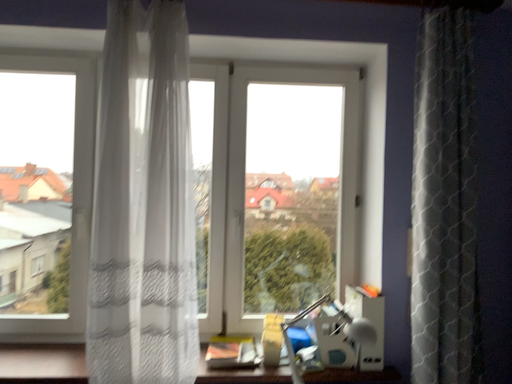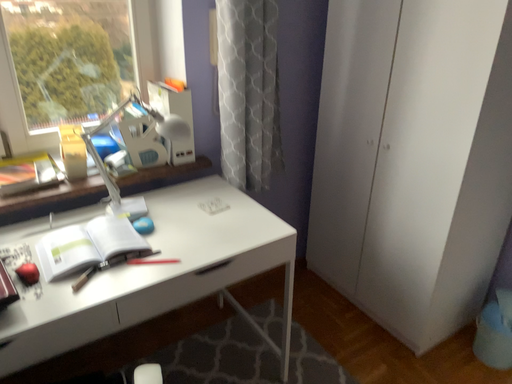
Question: How did the camera likely rotate when shooting the video?

Choices:
 (A) rotated left
 (B) rotated right

Answer: (B)